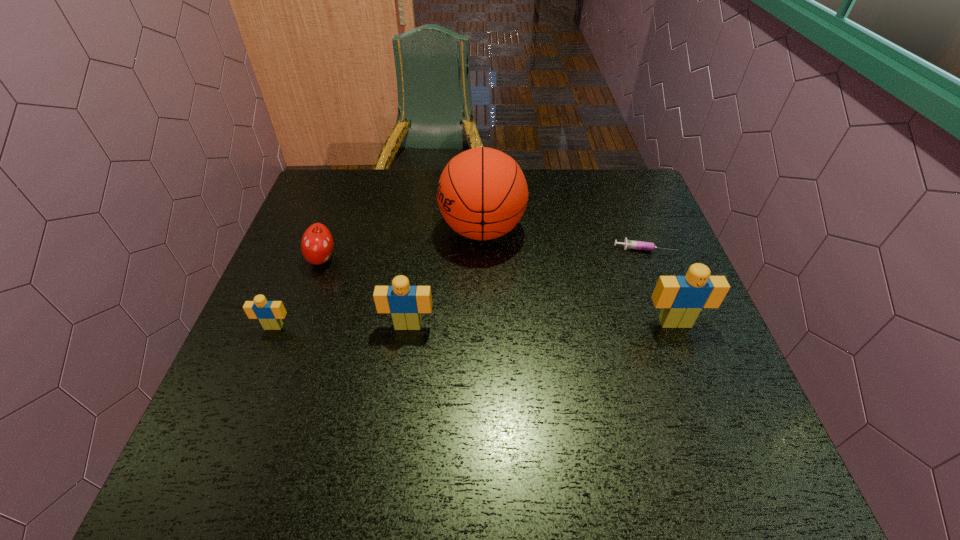
The height and width of the screenshot is (540, 960). In the image, there is a desktop. Find the location of `vacant space at the far edge`. vacant space at the far edge is located at coordinates (590, 212).

In the image, there is a desktop. Identify the location of vacant space at the near edge. The height and width of the screenshot is (540, 960). (545, 386).

In the image, there is a desktop. At what (x,y) coordinates should I click in order to perform the action: click on vacant space at the left edge. Please return your answer as a coordinate pair (x, y). Image resolution: width=960 pixels, height=540 pixels. Looking at the image, I should click on (293, 253).

In the image, there is a desktop. What are the coordinates of `vacant space at the right edge` in the screenshot? It's located at (643, 274).

In the image, there is a desktop. At what (x,y) coordinates should I click in order to perform the action: click on blank space at the far right corner. Please return your answer as a coordinate pair (x, y). Looking at the image, I should click on (639, 196).

In the image, there is a desktop. Identify the location of vacant space at the near right corner. (682, 418).

The height and width of the screenshot is (540, 960). What are the coordinates of `free space between the tallest object and the syringe` in the screenshot? It's located at (564, 239).

Find the location of a particular element. The width and height of the screenshot is (960, 540). empty space that is in between the second tallest Lego and the leftmost Lego is located at coordinates (341, 326).

This screenshot has height=540, width=960. Identify the location of vacant space in between the rightmost Lego and the apple. (498, 291).

This screenshot has height=540, width=960. What are the coordinates of `free space between the leftmost Lego and the fourth shortest object` in the screenshot? It's located at (341, 326).